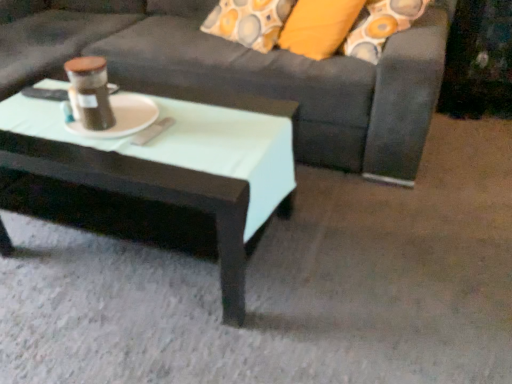
The image size is (512, 384). I want to click on free space to the left of matte brown jar at center, so click(x=34, y=129).